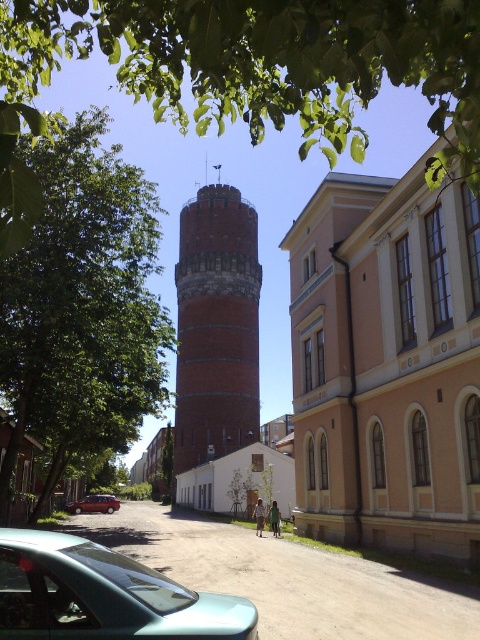
You are a pedestrian standing at the intersection and want to walk to the teal matte car at lower left. There is a green leafy tree at center blocking your path. Which direction should you move to avoid the tree and reach the car?

The green leafy tree at center is positioned on the right side of the teal matte car at lower left, so you should move to the left side of the tree to reach the teal matte car at lower left.

You are standing at the center of the street and want to take a photo of the green leafy tree at center. Where should you position yourself to ensure the tree is in the frame?

You should position yourself at the center of the street because the green leafy tree at center is located at point (x=83, y=305), which is near the central area of the image.